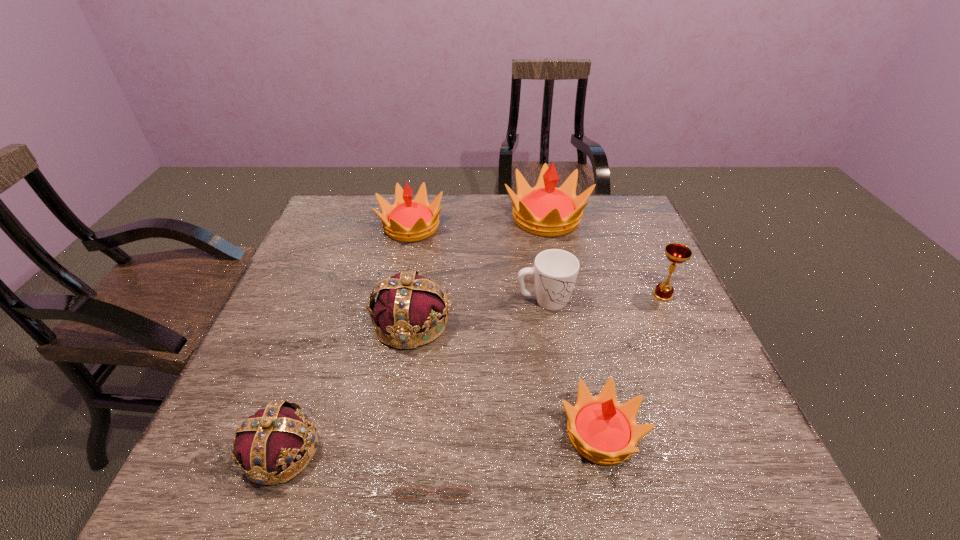
You are a GUI agent. You are given a task and a screenshot of the screen. Output one action in this format:
    pyautogui.click(x=<x>, y=<y>)
    Task: Click on the free spot between the sunglasses and the third nearest crown
    The width and height of the screenshot is (960, 540).
    Given the screenshot: What is the action you would take?
    pyautogui.click(x=423, y=396)

What are the coordinates of `free area in between the leftmost yellow crown and the nearest yellow crown` in the screenshot? It's located at (506, 330).

Image resolution: width=960 pixels, height=540 pixels. I want to click on vacant area between the chalice and the farther purple crown, so click(538, 309).

Locate an element on the screen. vacant point located between the smaller purple crown and the mug is located at coordinates (413, 376).

Locate an element on the screen. The image size is (960, 540). object that is the sixth closest to the biggest yellow crown is located at coordinates (408, 492).

This screenshot has height=540, width=960. In order to click on object that is the fourth nearest to the smaller purple crown in this screenshot , I will do `click(555, 271)`.

Point out which crown is positioned as the third nearest to the right purple crown. Please provide its 2D coordinates. Your answer should be formatted as a tuple, i.e. [(x, y)], where the tuple contains the x and y coordinates of a point satisfying the conditions above.

[(602, 430)]

Locate an element on the screen. crown object that ranks as the second closest to the nearest yellow crown is located at coordinates (273, 438).

Where is `yellow crown that stands as the closest to the tallest crown`? The image size is (960, 540). yellow crown that stands as the closest to the tallest crown is located at coordinates (407, 220).

Where is `the closest yellow crown to the sunglasses`? the closest yellow crown to the sunglasses is located at coordinates coord(602,430).